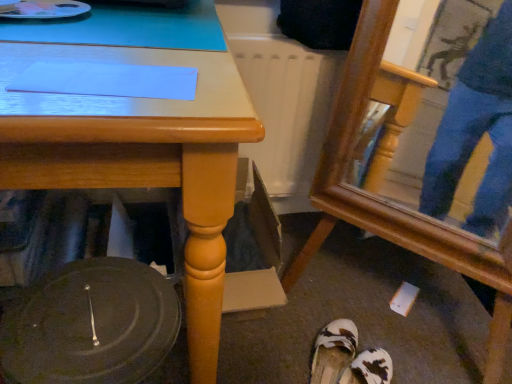
Question: Can you see white fabric sandals at lower center, which ranks as the second footwear in bottom-to-top order, touching white textured sandals at lower center, the second footwear when ordered from top to bottom?

Choices:
 (A) yes
 (B) no

Answer: (A)

Question: Is white fabric sandals at lower center, which ranks as the second footwear in bottom-to-top order, to the right of white textured sandals at lower center, the second footwear when ordered from top to bottom, from the viewer's perspective?

Choices:
 (A) yes
 (B) no

Answer: (B)

Question: Is white fabric sandals at lower center, the first footwear in the top-to-bottom sequence, completely or partially outside of white textured sandals at lower center, which is the 1th footwear in bottom-to-top order?

Choices:
 (A) no
 (B) yes

Answer: (B)

Question: Considering the relative sizes of white fabric sandals at lower center, the first footwear in the top-to-bottom sequence, and white textured sandals at lower center, which is the 1th footwear in bottom-to-top order, in the image provided, is white fabric sandals at lower center, the first footwear in the top-to-bottom sequence, wider than white textured sandals at lower center, which is the 1th footwear in bottom-to-top order,?

Choices:
 (A) yes
 (B) no

Answer: (B)

Question: Is white fabric sandals at lower center, which ranks as the second footwear in bottom-to-top order, positioned behind white textured sandals at lower center, the second footwear when ordered from top to bottom?

Choices:
 (A) yes
 (B) no

Answer: (A)

Question: Is point (364, 48) closer or farther from the camera than point (352, 365)?

Choices:
 (A) closer
 (B) farther

Answer: (A)

Question: From their relative heights in the image, would you say wooden swivel chair at lower right is taller or shorter than white textured sandals at lower center, which is the 1th footwear in bottom-to-top order?

Choices:
 (A) tall
 (B) short

Answer: (A)

Question: Is wooden swivel chair at lower right wider or thinner than white textured sandals at lower center, which is the 1th footwear in bottom-to-top order?

Choices:
 (A) thin
 (B) wide

Answer: (B)

Question: From a real-world perspective, is wooden swivel chair at lower right above or below white textured sandals at lower center, the second footwear when ordered from top to bottom?

Choices:
 (A) above
 (B) below

Answer: (A)

Question: Looking at the image, does wooden swivel chair at lower right seem bigger or smaller compared to white fabric sandals at lower center, the first footwear in the top-to-bottom sequence?

Choices:
 (A) big
 (B) small

Answer: (A)

Question: Considering the positions of wooden swivel chair at lower right and white fabric sandals at lower center, which ranks as the second footwear in bottom-to-top order, in the image, is wooden swivel chair at lower right wider or thinner than white fabric sandals at lower center, which ranks as the second footwear in bottom-to-top order,?

Choices:
 (A) wide
 (B) thin

Answer: (A)

Question: Is point (373, 213) positioned closer to the camera than point (340, 324)?

Choices:
 (A) closer
 (B) farther

Answer: (A)

Question: From a real-world perspective, relative to white fabric sandals at lower center, which ranks as the second footwear in bottom-to-top order, is wooden swivel chair at lower right vertically above or below?

Choices:
 (A) above
 (B) below

Answer: (A)

Question: From a real-world perspective, is white textured sandals at lower center, the second footwear when ordered from top to bottom, above or below white fabric sandals at lower center, the first footwear in the top-to-bottom sequence?

Choices:
 (A) below
 (B) above

Answer: (A)

Question: Considering their positions, is white textured sandals at lower center, the second footwear when ordered from top to bottom, located in front of or behind white fabric sandals at lower center, which ranks as the second footwear in bottom-to-top order?

Choices:
 (A) front
 (B) behind

Answer: (A)